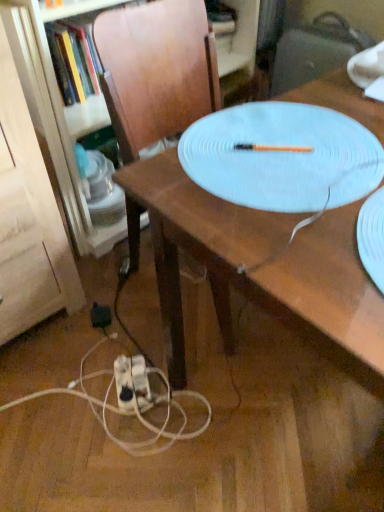
This screenshot has height=512, width=384. Find the location of `free point above white textured platter at center (from a real-world perspective)`. free point above white textured platter at center (from a real-world perspective) is located at coordinates (254, 144).